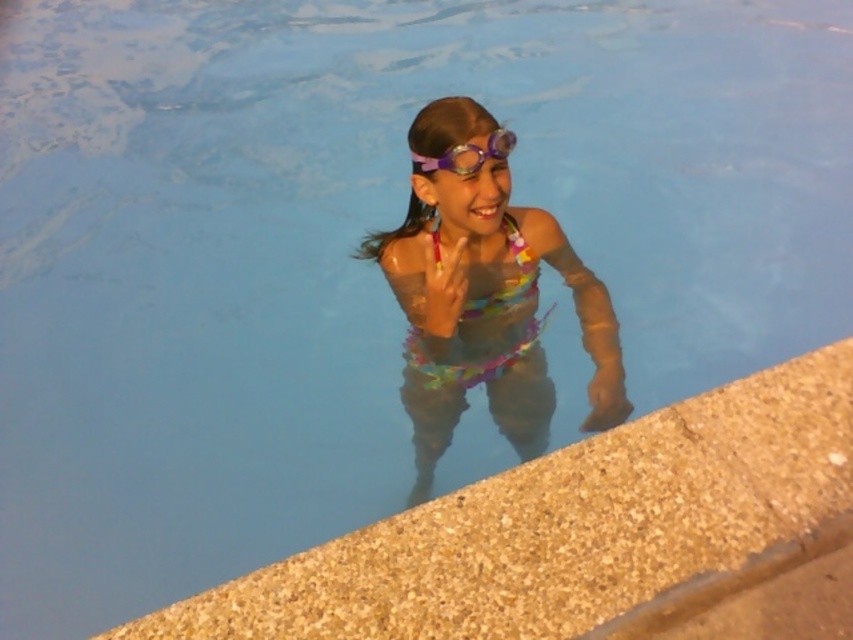
Question: Does smooth concrete ledge at lower right have a smaller size compared to multicolored fabric swimsuit at center?

Choices:
 (A) no
 (B) yes

Answer: (B)

Question: Which point appears closest to the camera in this image?

Choices:
 (A) (421, 220)
 (B) (480, 163)

Answer: (B)

Question: Which object is closer to the camera taking this photo?

Choices:
 (A) multicolored fabric swimsuit at center
 (B) purple matte goggles at upper center
 (C) smooth concrete ledge at lower right

Answer: (C)

Question: Does smooth concrete ledge at lower right appear over purple matte goggles at upper center?

Choices:
 (A) no
 (B) yes

Answer: (A)

Question: Is smooth concrete ledge at lower right smaller than multicolored fabric swimsuit at center?

Choices:
 (A) no
 (B) yes

Answer: (B)

Question: Estimate the real-world distances between objects in this image. Which object is farther from the purple matte goggles at upper center?

Choices:
 (A) smooth concrete ledge at lower right
 (B) multicolored fabric swimsuit at center

Answer: (A)